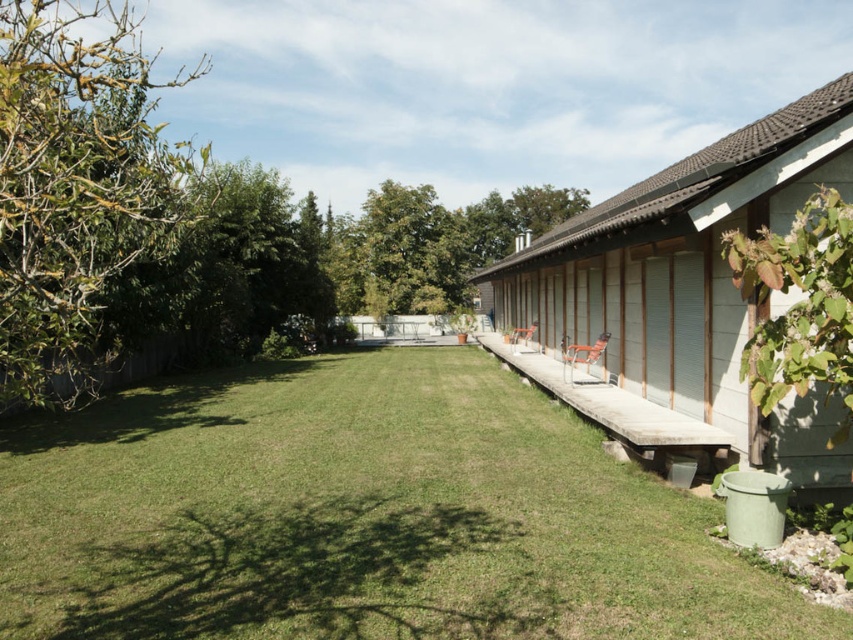
Question: Is green grass at center to the left of white wood hut at right from the viewer's perspective?

Choices:
 (A) no
 (B) yes

Answer: (B)

Question: From the image, what is the correct spatial relationship of green grass at center in relation to white wood hut at right?

Choices:
 (A) left
 (B) right

Answer: (A)

Question: Does green grass at center appear on the right side of white wood hut at right?

Choices:
 (A) no
 (B) yes

Answer: (A)

Question: Which point is closer to the camera taking this photo?

Choices:
 (A) (273, 422)
 (B) (579, 237)

Answer: (B)